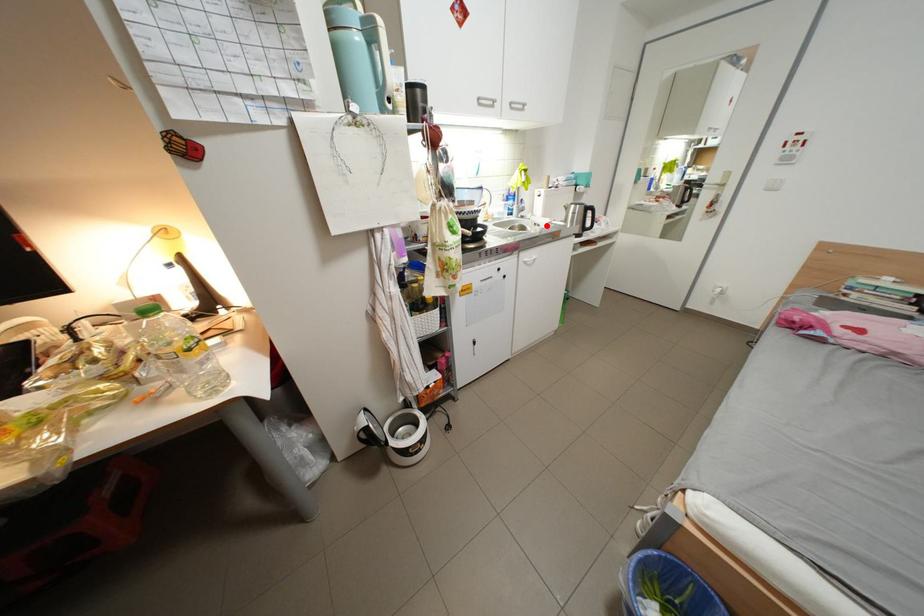
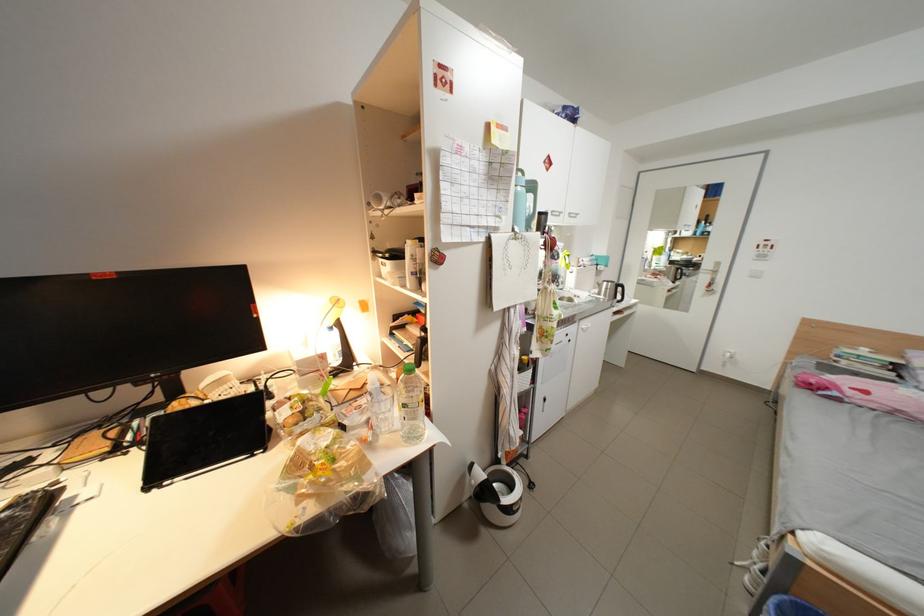
Question: I am providing you with two images of the same scene from different viewpoints. A red point is shown in image1. For the corresponding object point in image2, is it positioned nearer or farther from the camera?

Choices:
 (A) Nearer
 (B) Farther

Answer: (B)